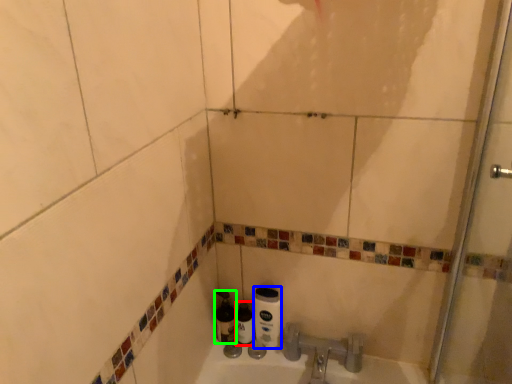
Question: Considering the real-world distances, which object is farthest from bottle (highlighted by a red box)? toilet paper (highlighted by a blue box) or bottle (highlighted by a green box)?

Choices:
 (A) toilet paper
 (B) bottle

Answer: (A)